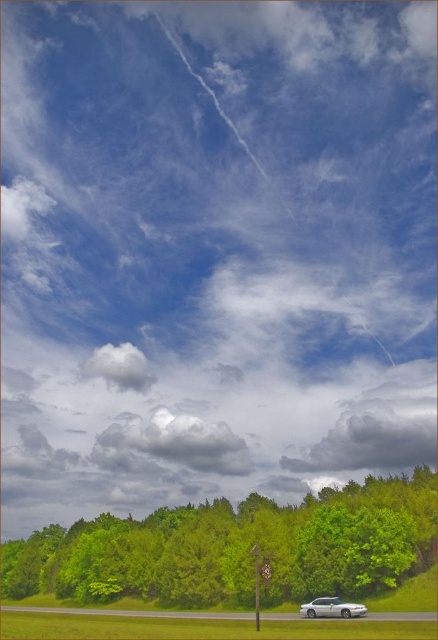
Is point (235, 436) closer to viewer compared to point (136, 388)?

Yes, point (235, 436) is closer to viewer.

Does white fluffy cloud at center appear over white fluffy cloud at upper center?

Actually, white fluffy cloud at center is below white fluffy cloud at upper center.

Between point (216, 448) and point (130, 376), which one is positioned in front?

Point (216, 448) is more forward.

What are the coordinates of `white fluffy cloud at center` in the screenshot? It's located at (170, 444).

Between white fluffy cloud at upper center and white glossy sedan at lower center, which one is positioned lower?

white glossy sedan at lower center is lower down.

Is white fluffy cloud at upper center shorter than white glossy sedan at lower center?

No.

Measure the distance between point (144, 356) and camera.

Point (144, 356) and camera are 217.48 meters apart from each other.

I want to click on white fluffy cloud at upper center, so click(120, 365).

Who is positioned more to the right, green leafy tree at lower center or white fluffy cloud at upper center?

green leafy tree at lower center

Is green leafy tree at lower center thinner than white fluffy cloud at upper center?

No, green leafy tree at lower center is not thinner than white fluffy cloud at upper center.

In order to click on green leafy tree at lower center in this screenshot , I will do `click(239, 548)`.

At what (x,y) coordinates should I click in order to perform the action: click on green leafy tree at lower center. Please return your answer as a coordinate pair (x, y). This screenshot has width=438, height=640. Looking at the image, I should click on (239, 548).